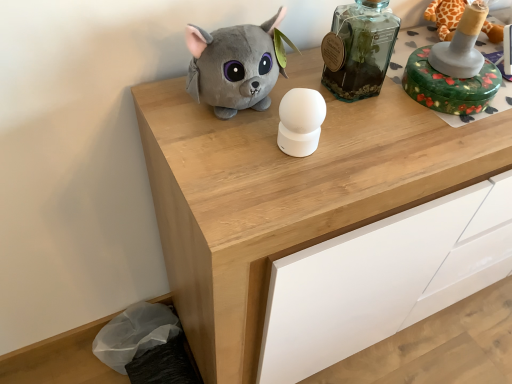
Identify the location of vacant space that's between green floral-patterned box at upper right, the 1th toy when ordered from right to left, and transparent glass bottle at upper center. (388, 105).